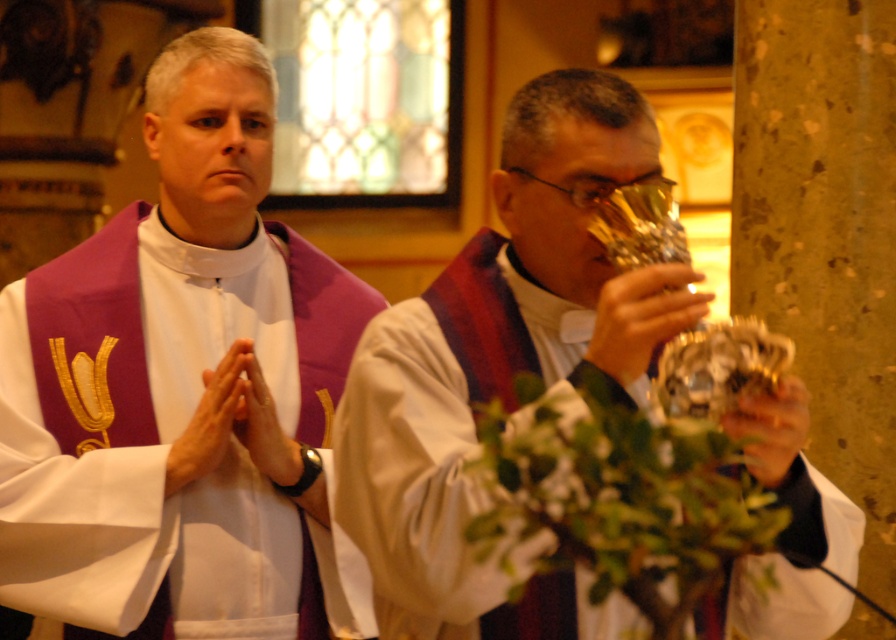
Question: Considering the relative positions of purple velvet stole at center and metallic gold chalice at center in the image provided, where is purple velvet stole at center located with respect to metallic gold chalice at center?

Choices:
 (A) below
 (B) above

Answer: (B)

Question: Which object appears farthest from the camera in this image?

Choices:
 (A) purple velvet stole at center
 (B) metallic gold chalice at center

Answer: (A)

Question: Is purple velvet stole at center to the right of metallic gold chalice at center from the viewer's perspective?

Choices:
 (A) no
 (B) yes

Answer: (A)

Question: In this image, where is purple velvet stole at center located relative to metallic gold chalice at center?

Choices:
 (A) below
 (B) above

Answer: (B)